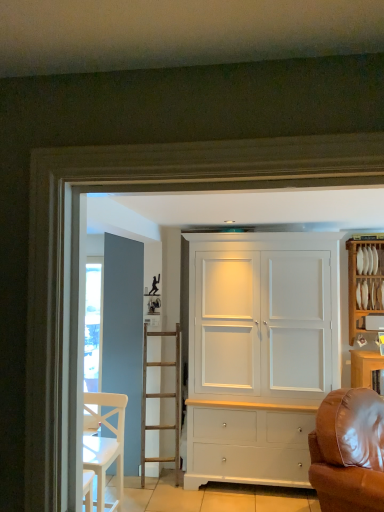
Question: Is brown leather couch at right shorter than white wooden chair at lower left?

Choices:
 (A) yes
 (B) no

Answer: (B)

Question: Considering the relative sizes of brown leather couch at right and white wooden chair at lower left in the image provided, is brown leather couch at right taller than white wooden chair at lower left?

Choices:
 (A) yes
 (B) no

Answer: (A)

Question: Are brown leather couch at right and white wooden chair at lower left beside each other?

Choices:
 (A) yes
 (B) no

Answer: (B)

Question: Does brown leather couch at right lie in front of white wooden chair at lower left?

Choices:
 (A) no
 (B) yes

Answer: (B)

Question: Could you tell me if brown leather couch at right is turned towards white wooden chair at lower left?

Choices:
 (A) no
 (B) yes

Answer: (A)

Question: From the image's perspective, is white matte cabinet at center above or below brown leather couch at right?

Choices:
 (A) above
 (B) below

Answer: (A)

Question: From their relative heights in the image, would you say white matte cabinet at center is taller or shorter than brown leather couch at right?

Choices:
 (A) tall
 (B) short

Answer: (A)

Question: Based on their sizes in the image, would you say white matte cabinet at center is bigger or smaller than brown leather couch at right?

Choices:
 (A) big
 (B) small

Answer: (A)

Question: Is white matte cabinet at center inside or outside of brown leather couch at right?

Choices:
 (A) outside
 (B) inside

Answer: (A)

Question: Is brown leather couch at right bigger or smaller than white matte cabinet at center?

Choices:
 (A) small
 (B) big

Answer: (A)

Question: From the image's perspective, is brown leather couch at right located above or below white matte cabinet at center?

Choices:
 (A) above
 (B) below

Answer: (B)

Question: Is brown leather couch at right inside the boundaries of white matte cabinet at center, or outside?

Choices:
 (A) outside
 (B) inside

Answer: (A)

Question: Is brown leather couch at right taller or shorter than white matte cabinet at center?

Choices:
 (A) tall
 (B) short

Answer: (B)

Question: Considering the positions of white wooden chair at lower left and brown leather couch at right in the image, is white wooden chair at lower left wider or thinner than brown leather couch at right?

Choices:
 (A) wide
 (B) thin

Answer: (B)

Question: From a real-world perspective, is white wooden chair at lower left physically located above or below brown leather couch at right?

Choices:
 (A) below
 (B) above

Answer: (B)